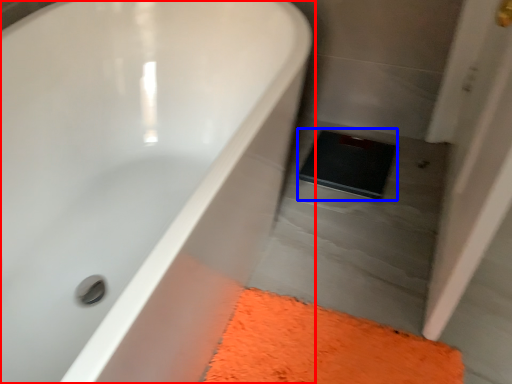
Question: Which of the following is the farthest to the observer, bathtub (highlighted by a red box) or pad (highlighted by a blue box)?

Choices:
 (A) bathtub
 (B) pad

Answer: (B)